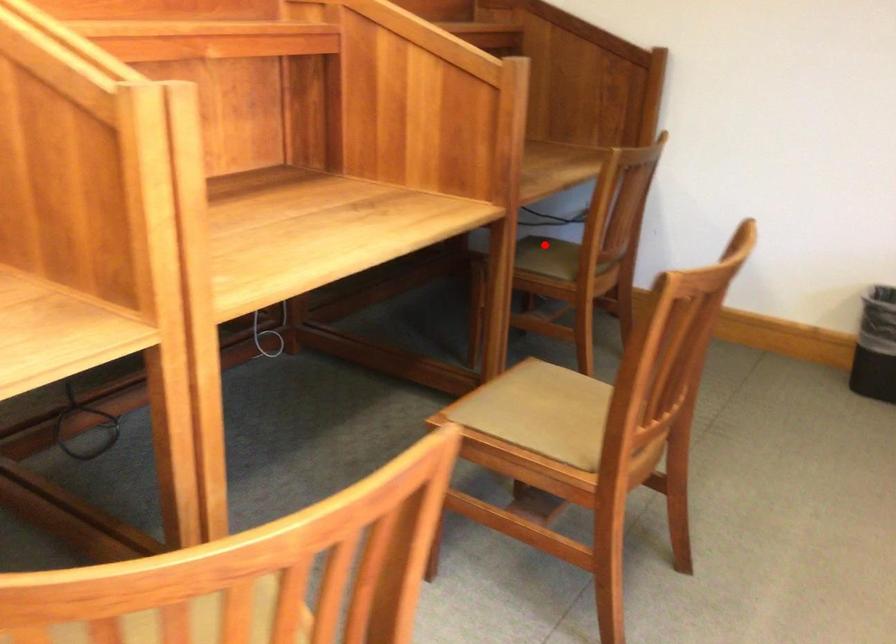
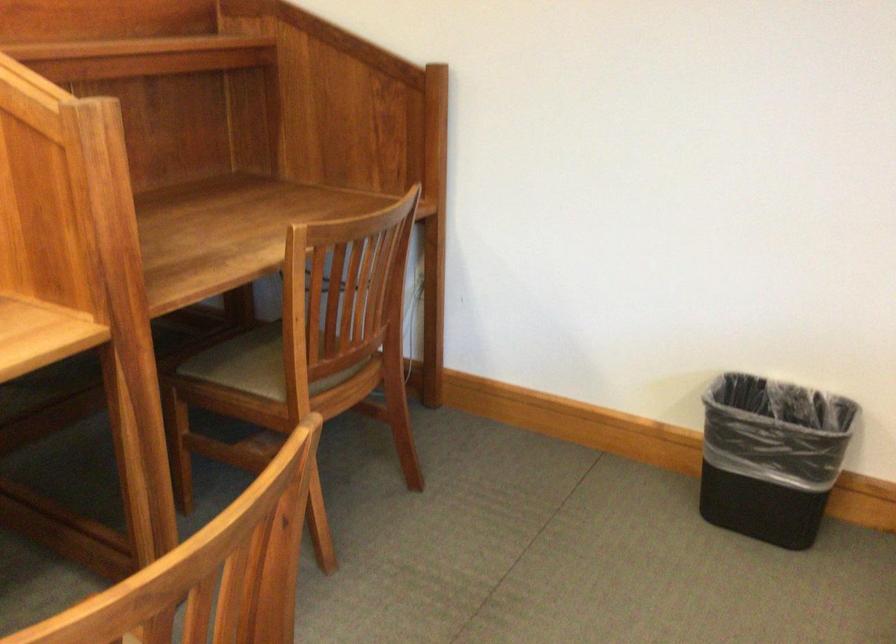
Question: I am providing you with two images of the same scene from different viewpoints. Image1 has a red point marked. In image2, the corresponding 3D location appears at what relative position? Reply with the corresponding letter.

Choices:
 (A) Closer
 (B) Farther

Answer: (A)